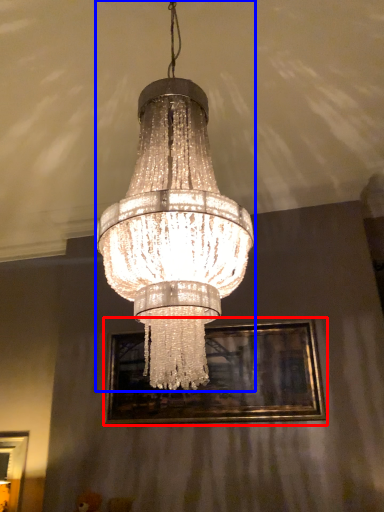
Question: Which object is closer to the camera taking this photo, picture frame (highlighted by a red box) or lamp (highlighted by a blue box)?

Choices:
 (A) picture frame
 (B) lamp

Answer: (B)